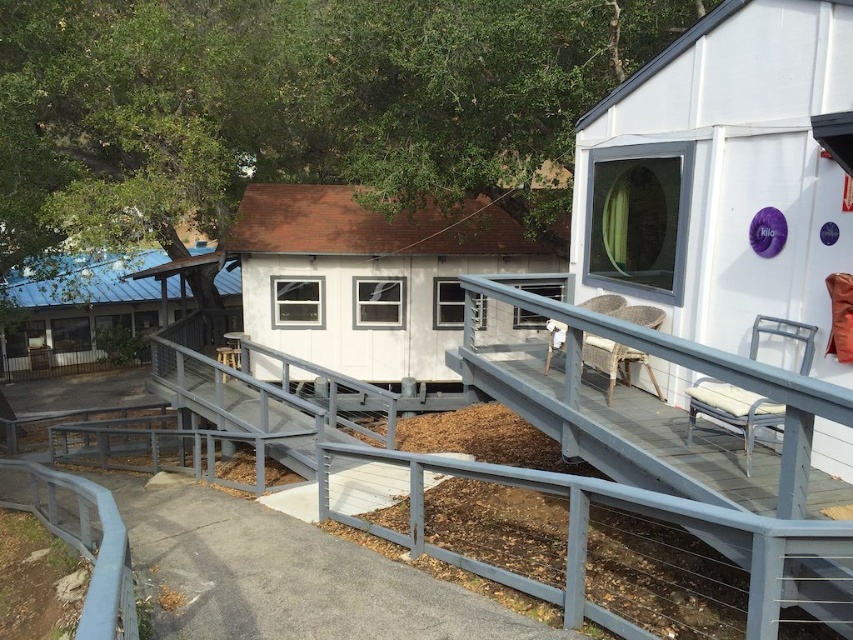
Question: Can you confirm if white wood cabin at center is positioned below blue corrugated metal hut at left?

Choices:
 (A) yes
 (B) no

Answer: (A)

Question: Based on their relative distances, which object is farther from the white wood cabin at center?

Choices:
 (A) blue corrugated metal hut at left
 (B) gray metal rail at center

Answer: (A)

Question: Which object appears closest to the camera in this image?

Choices:
 (A) blue corrugated metal hut at left
 (B) white matte hut at upper right

Answer: (B)

Question: Which of the following is the farthest from the observer?

Choices:
 (A) (766, 145)
 (B) (438, 380)

Answer: (B)

Question: Does gray metal rail at center appear on the right side of blue corrugated metal hut at left?

Choices:
 (A) yes
 (B) no

Answer: (A)

Question: Does white matte hut at upper right appear over blue corrugated metal hut at left?

Choices:
 (A) yes
 (B) no

Answer: (B)